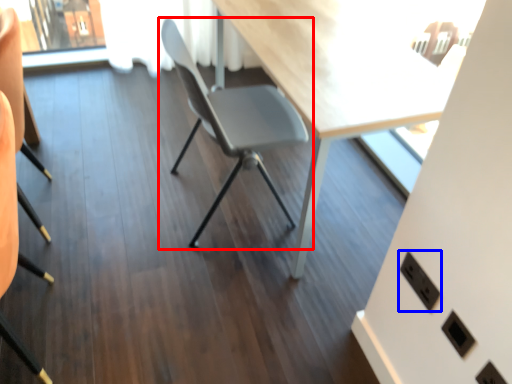
Question: Which object is closer to the camera taking this photo, chair (highlighted by a red box) or electric outlet (highlighted by a blue box)?

Choices:
 (A) chair
 (B) electric outlet

Answer: (B)